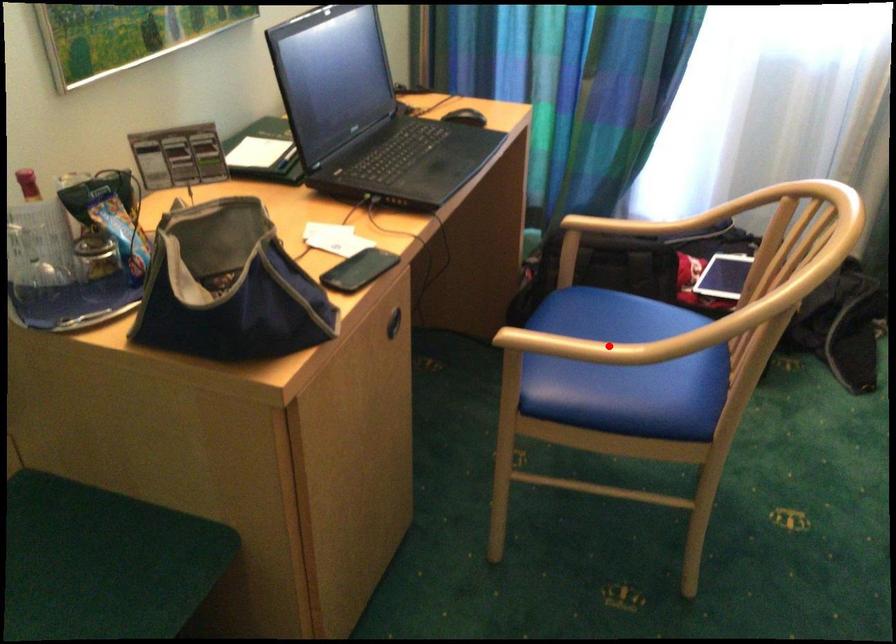
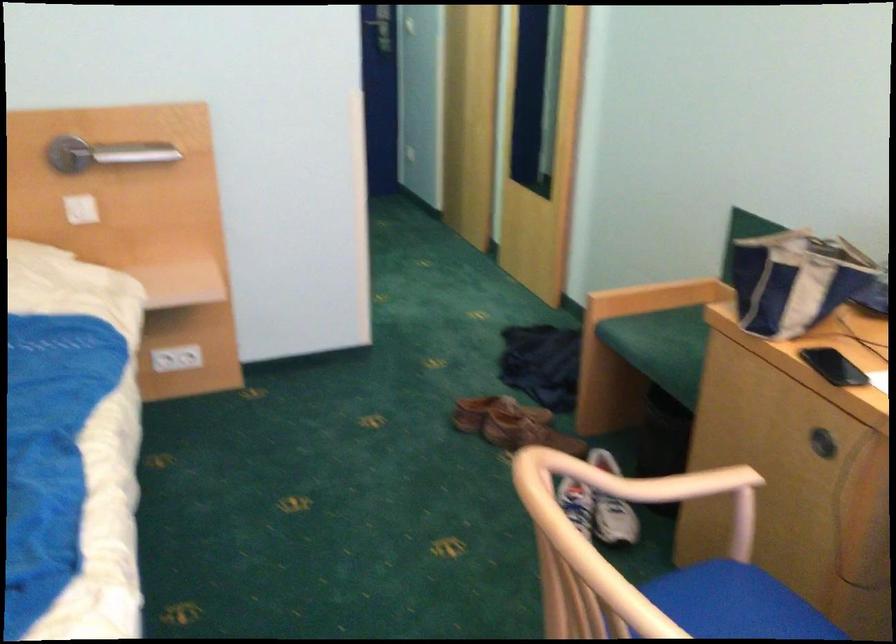
Question: I am providing you with two images of the same scene from different viewpoints. Given a red point in image1, look at the same physical point in image2. Is it:

Choices:
 (A) Closer to the viewpoint
 (B) Farther from the viewpoint

Answer: (B)